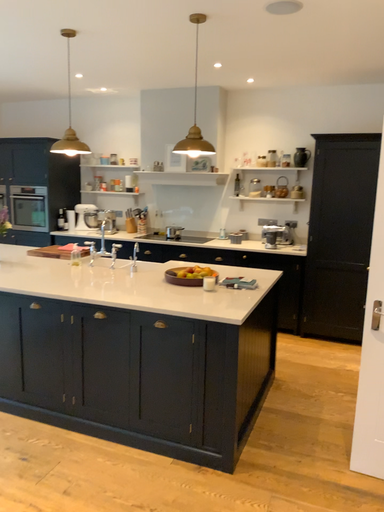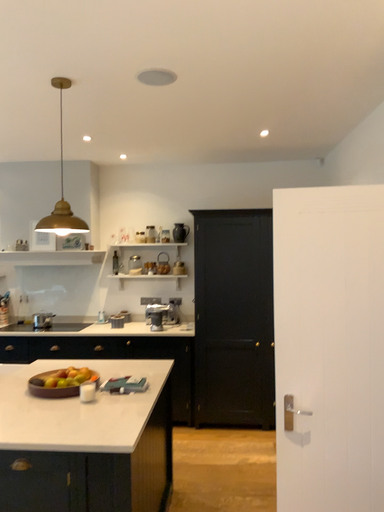
Question: Which way did the camera rotate in the video?

Choices:
 (A) rotated left
 (B) rotated right

Answer: (B)